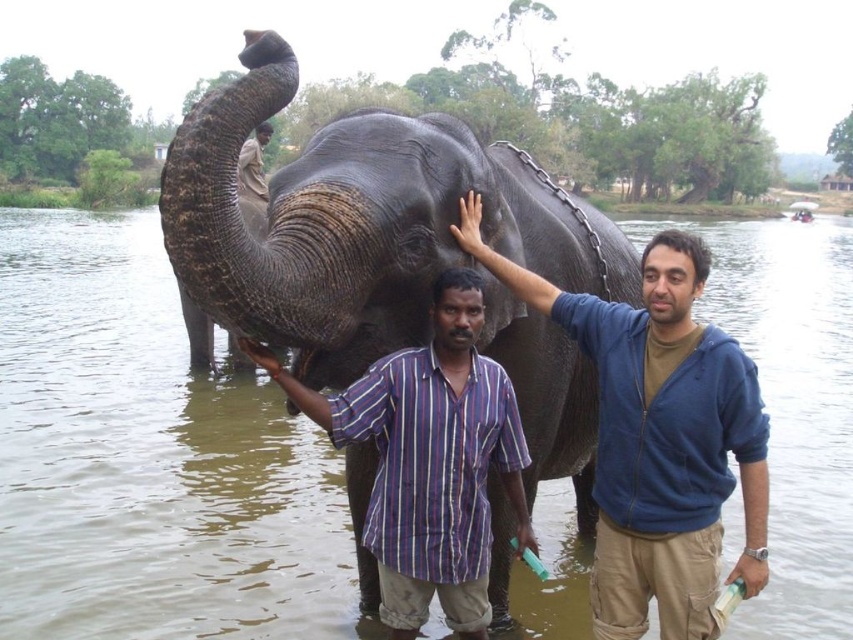
You are standing at the riverbank and see two people wearing shirts. The striped cotton shirt at center and the brown cotton shirt at upper center. Which shirt is positioned more to the right?

The striped cotton shirt at center is positioned more to the right than the brown cotton shirt at upper center.